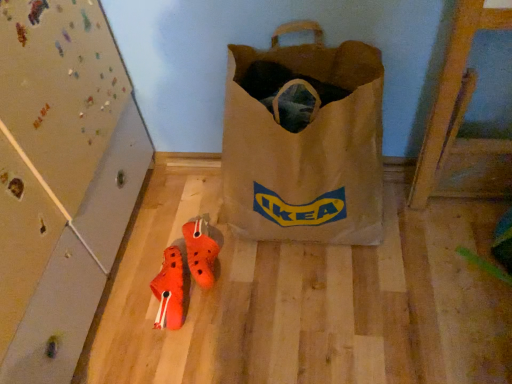
Question: Considering the positions of orange matte sneakers at lower center, placed as the second footwear when sorted from right to left, and brown paper bag at center in the image, is orange matte sneakers at lower center, placed as the second footwear when sorted from right to left, taller or shorter than brown paper bag at center?

Choices:
 (A) tall
 (B) short

Answer: (B)

Question: In terms of width, does orange matte sneakers at lower center, arranged as the first footwear when viewed from the left, look wider or thinner when compared to brown paper bag at center?

Choices:
 (A) thin
 (B) wide

Answer: (A)

Question: Which object is positioned closest to the orange rubber clogs at center, the 1th footwear viewed from the right?

Choices:
 (A) brown paper bag at center
 (B) orange matte sneakers at lower center, placed as the second footwear when sorted from right to left

Answer: (B)

Question: Which object is positioned closest to the orange matte sneakers at lower center, arranged as the first footwear when viewed from the left?

Choices:
 (A) brown paper bag at center
 (B) orange rubber clogs at center, the 1th footwear viewed from the right

Answer: (B)